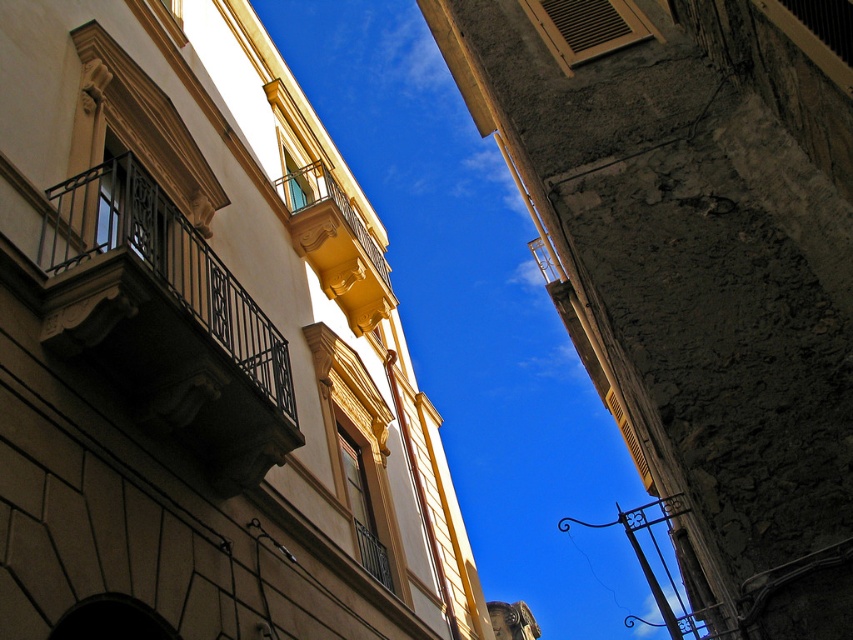
Does rough concrete wall at upper right have a lesser height compared to black wrought iron balcony at left?

Incorrect, rough concrete wall at upper right's height does not fall short of black wrought iron balcony at left's.

Is point (572, 122) positioned before point (149, 372)?

No, it is not.

Where is `rough concrete wall at upper right`? rough concrete wall at upper right is located at coordinates (695, 264).